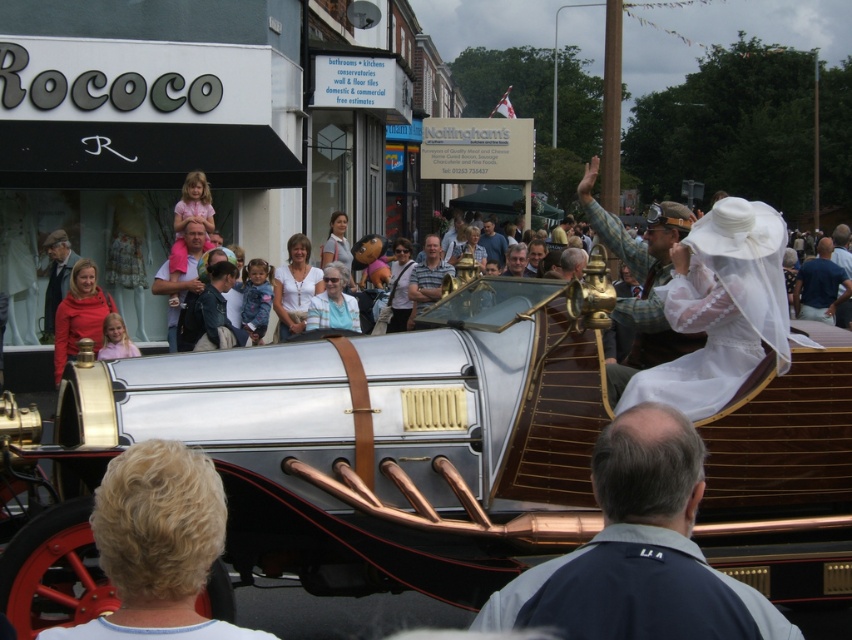
You are a photographer standing at the origin point of the coordinate system. You want to take a photo of the polished silver car at center. What are the coordinates where you should aim your camera?

The polished silver car at center is located at coordinates (370, 440), so you should aim your camera at those coordinates to capture it.

You are a photographer trying to capture a photo of the polished silver car at center and the dark blue fabric jacket at center. If you want to ensure both are fully visible in the frame, which object should you focus on to avoid cropping?

You should focus on the polished silver car at center because it might be wider than the dark blue fabric jacket at center, so centering the car ensures both are fully visible.

You are standing on the street and see two points marked in the image. The first point is labeled as point (49,275) and the second is point (426,288). Which point is closer to you?

Point (426,288) is closer to you because it is in front of point (49,275).